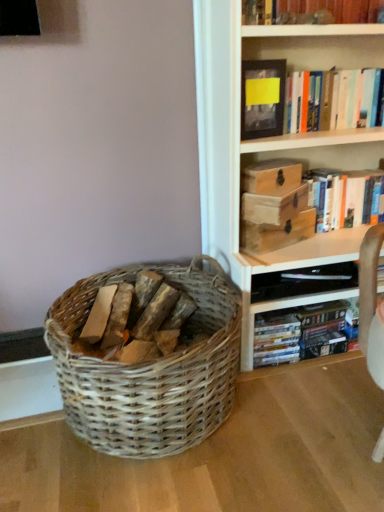
Find the location of a particular element. This screenshot has height=512, width=384. free spot in front of matte black shelf at lower right is located at coordinates (314, 402).